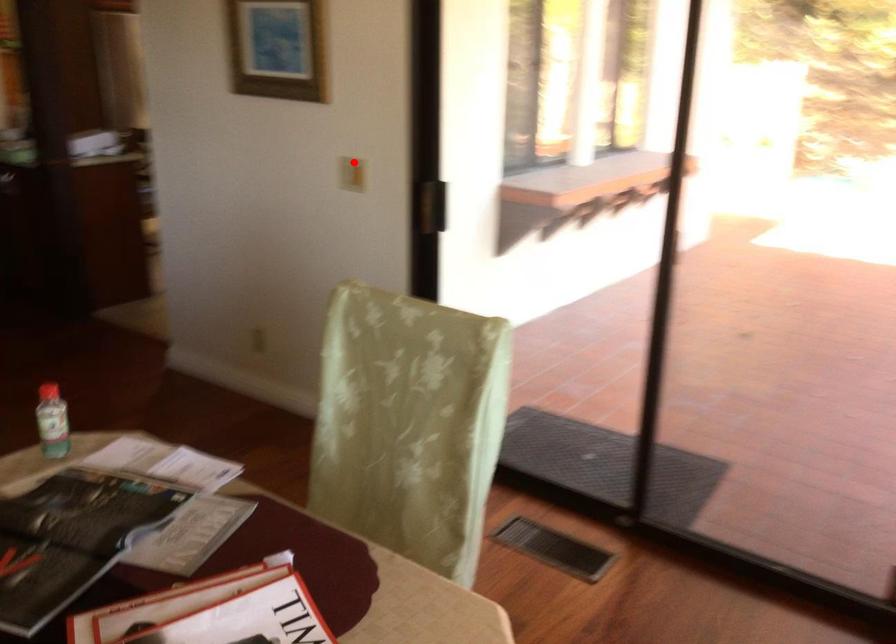
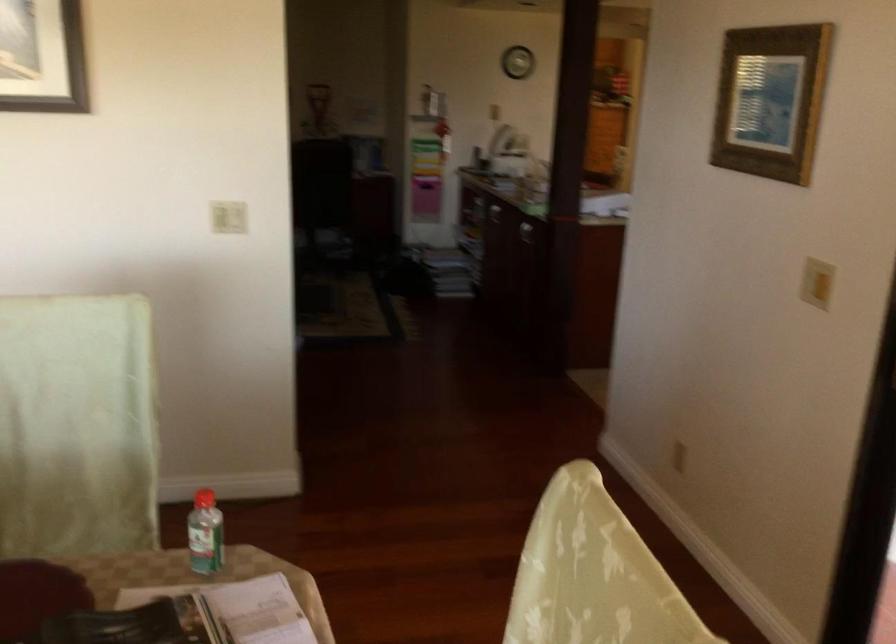
Question: I am providing you with two images of the same scene from different viewpoints. In image1, a red point is highlighted. Considering the same 3D point in image2, which of the following is correct?

Choices:
 (A) It is closer
 (B) It is farther

Answer: (A)